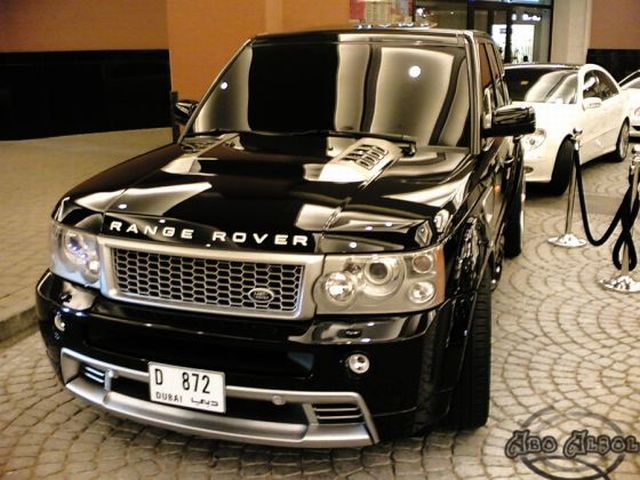
I want to click on hood, so click(438, 158), click(210, 160).